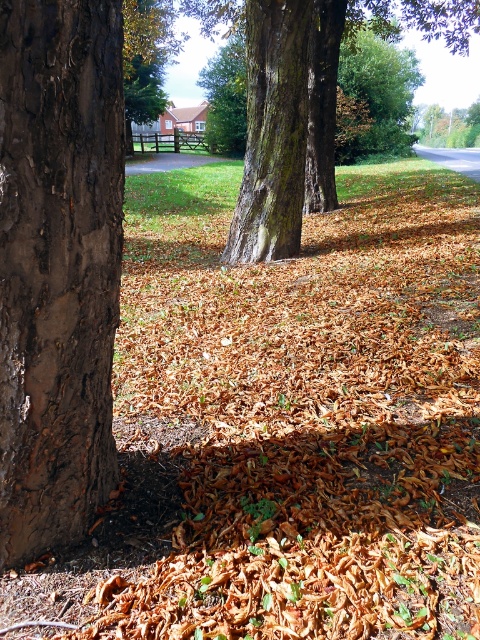
Is point (109, 60) behind point (272, 20)?

No.

This screenshot has height=640, width=480. What are the coordinates of `brown rough bark at left` in the screenshot? It's located at (58, 266).

Who is more distant from viewer, (46,8) or (276,104)?

The point (276,104) is behind.

Where is `brown rough bark at left`? This screenshot has width=480, height=640. brown rough bark at left is located at coordinates (58, 266).

Can you confirm if smooth bark tree at center is thinner than smooth bark tree trunk at center?

In fact, smooth bark tree at center might be wider than smooth bark tree trunk at center.

Who is taller, smooth bark tree at center or smooth bark tree trunk at center?

smooth bark tree at center

You are a GUI agent. You are given a task and a screenshot of the screen. Output one action in this format:
    pyautogui.click(x=<x>, y=<y>)
    Task: Click on the smooth bark tree at center
    
    Given the screenshot: What is the action you would take?
    pyautogui.click(x=303, y=100)

Does point (56, 356) come behind point (257, 92)?

No.

Image resolution: width=480 pixels, height=640 pixels. What do you see at coordinates (58, 266) in the screenshot?
I see `brown rough bark at left` at bounding box center [58, 266].

Identify the location of brown rough bark at left. (58, 266).